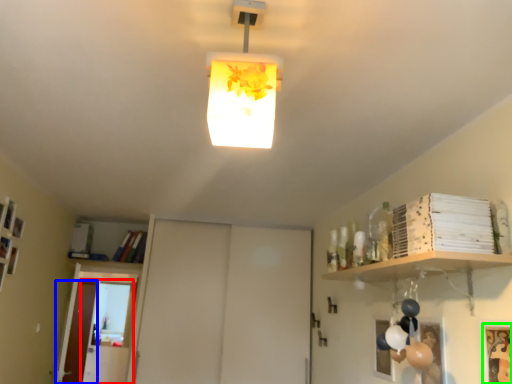
Question: Estimate the real-world distances between objects in this image. Which object is closer to glass door (highlighted by a red box), door (highlighted by a blue box) or picture frame (highlighted by a green box)?

Choices:
 (A) door
 (B) picture frame

Answer: (A)